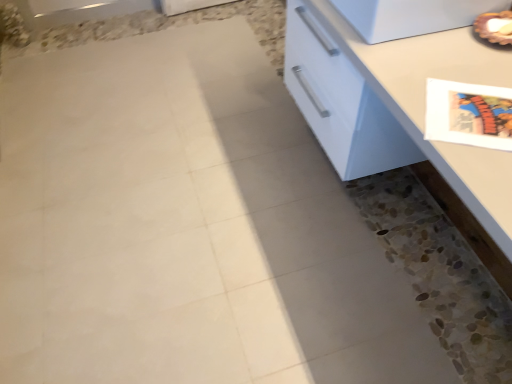
Find the location of a particular element. The height and width of the screenshot is (384, 512). white glossy refrigerator at upper right is located at coordinates (412, 16).

What do you see at coordinates (412, 16) in the screenshot?
I see `white glossy refrigerator at upper right` at bounding box center [412, 16].

This screenshot has height=384, width=512. What do you see at coordinates (396, 105) in the screenshot?
I see `white glossy countertop at right` at bounding box center [396, 105].

Find the location of `white glossy countertop at right`. white glossy countertop at right is located at coordinates (396, 105).

Locate an element on the screen. The width and height of the screenshot is (512, 384). white glossy refrigerator at upper right is located at coordinates (412, 16).

Is white glossy countertop at right at the right side of white glossy refrigerator at upper right?

Correct, you'll find white glossy countertop at right to the right of white glossy refrigerator at upper right.

Which object is more forward, white glossy countertop at right or white glossy refrigerator at upper right?

white glossy countertop at right is in front.

Is point (496, 171) positioned in front of point (450, 3)?

Yes.

From the image's perspective, is white glossy countertop at right on white glossy refrigerator at upper right?

No.

From a real-world perspective, which is physically above, white glossy countertop at right or white glossy refrigerator at upper right?

white glossy refrigerator at upper right.

Which of these two, white glossy countertop at right or white glossy refrigerator at upper right, is wider?

white glossy countertop at right is wider.

Can you confirm if white glossy countertop at right is shorter than white glossy refrigerator at upper right?

No, white glossy countertop at right is not shorter than white glossy refrigerator at upper right.

Consider the image. Based on their sizes in the image, would you say white glossy countertop at right is bigger or smaller than white glossy refrigerator at upper right?

Clearly, white glossy countertop at right is larger in size than white glossy refrigerator at upper right.

Can white glossy refrigerator at upper right be found inside white glossy countertop at right?

No, white glossy refrigerator at upper right is not inside white glossy countertop at right.

Is white glossy countertop at right touching white glossy refrigerator at upper right?

No, white glossy countertop at right is not in contact with white glossy refrigerator at upper right.

Consider the image. Is white glossy countertop at right aimed at white glossy refrigerator at upper right?

No, white glossy countertop at right is not oriented towards white glossy refrigerator at upper right.

How many degrees apart are the facing directions of white glossy countertop at right and white glossy refrigerator at upper right?

0.000561 degrees separate the facing orientations of white glossy countertop at right and white glossy refrigerator at upper right.

At what (x,y) coordinates should I click in order to perform the action: click on appliance behind the white glossy countertop at right. Please return your answer as a coordinate pair (x, y). Looking at the image, I should click on (412, 16).

Does white glossy refrigerator at upper right appear on the right side of white glossy countertop at right?

In fact, white glossy refrigerator at upper right is to the left of white glossy countertop at right.

In the image, is white glossy refrigerator at upper right positioned in front of or behind white glossy countertop at right?

Clearly, white glossy refrigerator at upper right is behind white glossy countertop at right.

Which point is more forward, [449,23] or [407,57]?

The point [407,57] is closer.

From the image's perspective, would you say white glossy refrigerator at upper right is positioned over white glossy countertop at right?

Indeed, from the image's perspective, white glossy refrigerator at upper right is shown above white glossy countertop at right.

From a real-world perspective, is white glossy refrigerator at upper right physically above white glossy countertop at right?

Yes, from a real-world perspective, white glossy refrigerator at upper right is on top of white glossy countertop at right.

Is white glossy refrigerator at upper right wider or thinner than white glossy countertop at right?

In the image, white glossy refrigerator at upper right appears to be more narrow than white glossy countertop at right.

Between white glossy refrigerator at upper right and white glossy countertop at right, which one has more height?

Standing taller between the two is white glossy countertop at right.

Can you confirm if white glossy refrigerator at upper right is bigger than white glossy countertop at right?

No.

Would you say white glossy refrigerator at upper right is outside white glossy countertop at right?

Yes, white glossy refrigerator at upper right is outside of white glossy countertop at right.

Would you consider white glossy refrigerator at upper right to be distant from white glossy countertop at right?

They are positioned close to each other.

Does white glossy refrigerator at upper right turn towards white glossy countertop at right?

No, white glossy refrigerator at upper right is not oriented towards white glossy countertop at right.

In the image, there is a white glossy countertop at right. Identify the location of appliance above it (from the image's perspective). Image resolution: width=512 pixels, height=384 pixels. (412, 16).

The width and height of the screenshot is (512, 384). In order to click on countertop beneath the white glossy refrigerator at upper right (from a real-world perspective) in this screenshot , I will do `click(396, 105)`.

This screenshot has width=512, height=384. Identify the location of appliance that is on the left side of white glossy countertop at right. (412, 16).